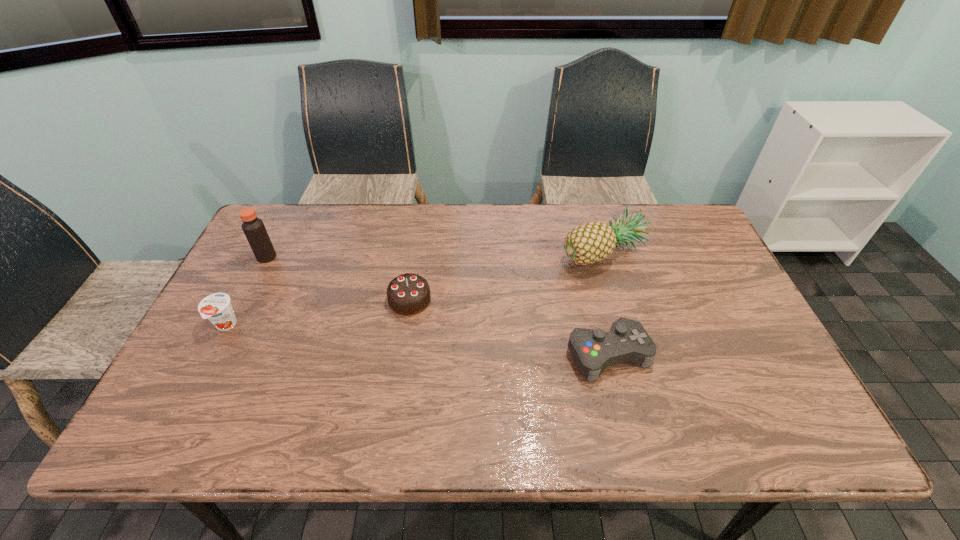
The image size is (960, 540). I want to click on vinegar, so click(x=253, y=227).

Locate an element on the screen. This screenshot has width=960, height=540. the second tallest object is located at coordinates (591, 242).

Find the location of `chocolate cake`. chocolate cake is located at coordinates (408, 294).

This screenshot has width=960, height=540. I want to click on yogurt, so click(x=216, y=307).

You are a GUI agent. You are given a task and a screenshot of the screen. Output one action in this format:
    pyautogui.click(x=<x>, y=<y>)
    Task: Click on the control
    
    Given the screenshot: What is the action you would take?
    (593, 350)

What are the coordinates of `vacant space located on the back of the vinegar` in the screenshot? It's located at (277, 237).

The height and width of the screenshot is (540, 960). What are the coordinates of `vacant space located on the left of the second tallest object` in the screenshot? It's located at (481, 253).

This screenshot has height=540, width=960. Find the location of `vacant space situated on the left of the chocolate cake`. vacant space situated on the left of the chocolate cake is located at coordinates (277, 300).

Locate an element on the screen. Image resolution: width=960 pixels, height=540 pixels. free space located on the front of the yogurt is located at coordinates (190, 394).

At what (x,y) coordinates should I click in order to perform the action: click on vacant space located on the back of the control. Please return your answer as a coordinate pair (x, y). Looking at the image, I should click on (578, 234).